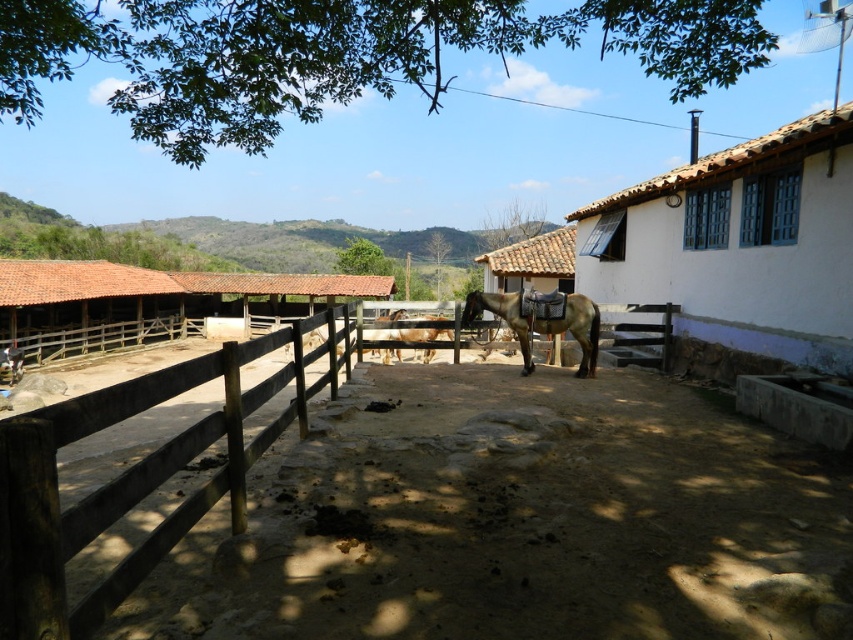
Question: Is brown wooden hut at center above brown tile hut at left?

Choices:
 (A) yes
 (B) no

Answer: (B)

Question: Can you confirm if brown wooden hut at center is smaller than brown glossy horse at center?

Choices:
 (A) no
 (B) yes

Answer: (A)

Question: Estimate the real-world distances between objects in this image. Which object is farther from the brown sandy dirt field at center?

Choices:
 (A) brown wooden hut at center
 (B) brown leather horse at center

Answer: (A)

Question: Does brown wooden hut at center appear under brown glossy horse at center?

Choices:
 (A) yes
 (B) no

Answer: (B)

Question: Which object is the closest to the brown leather horse at center?

Choices:
 (A) brown wooden hut at center
 (B) brown sandy dirt field at center
 (C) brown tile hut at left
 (D) brown glossy horse at center

Answer: (D)

Question: Considering the real-world distances, which object is farthest from the brown wooden fence at lower left?

Choices:
 (A) brown sandy dirt field at center
 (B) brown wooden hut at center

Answer: (B)